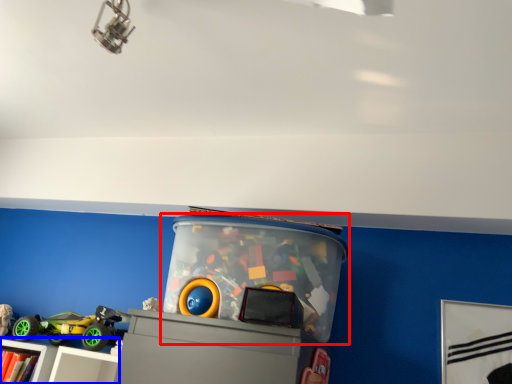
Question: Which of the following is the closest to the observer, toy (highlighted by a red box) or shelf (highlighted by a blue box)?

Choices:
 (A) toy
 (B) shelf

Answer: (A)